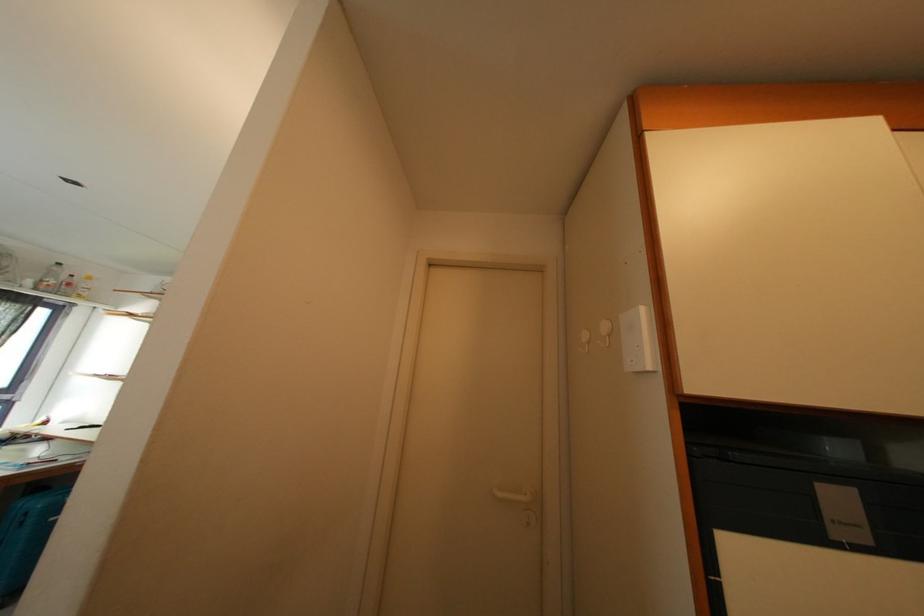
Identify the location of white door handle. Image resolution: width=924 pixels, height=616 pixels. (515, 493).